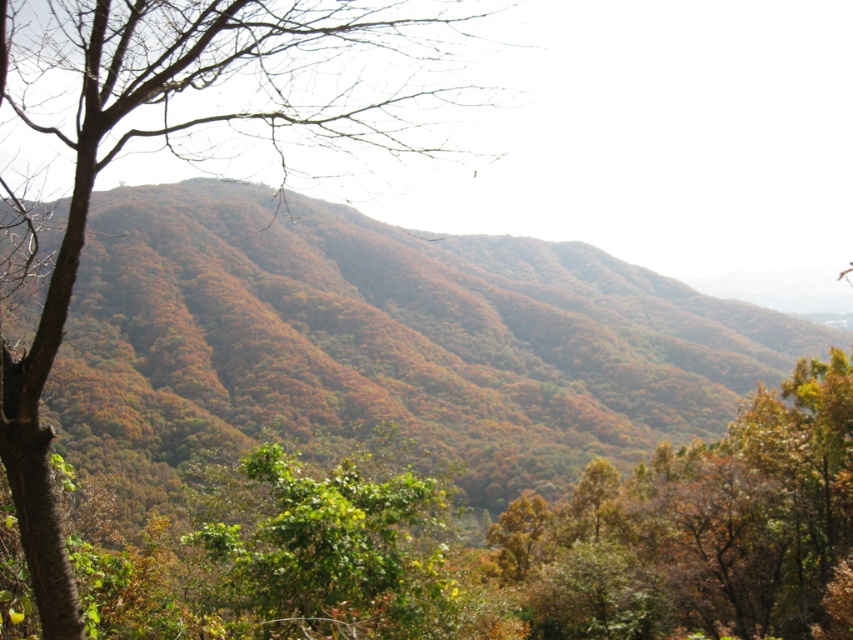
Question: Can you confirm if bare branches at left is positioned below green leafy tree at center?

Choices:
 (A) no
 (B) yes

Answer: (A)

Question: Which of the following is the farthest from the observer?

Choices:
 (A) (363, 131)
 (B) (219, 508)

Answer: (A)

Question: Can you confirm if bare branches at left is positioned to the left of green leafy tree at center?

Choices:
 (A) no
 (B) yes

Answer: (B)

Question: Which of the following is the closest to the observer?

Choices:
 (A) green leafy tree at center
 (B) bare branches at left

Answer: (B)

Question: From the image, what is the correct spatial relationship of bare branches at left in relation to green leafy tree at center?

Choices:
 (A) below
 (B) above

Answer: (B)